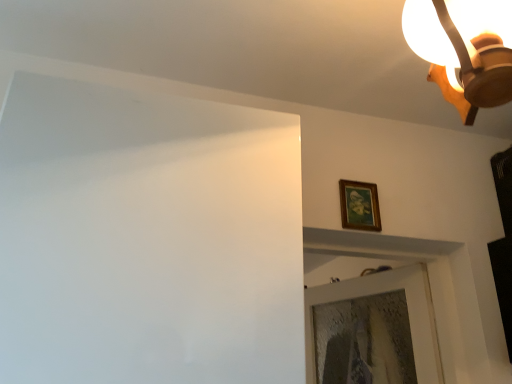
Question: From a real-world perspective, is wooden ceiling light at upper right located higher than wooden framed painting at upper right?

Choices:
 (A) yes
 (B) no

Answer: (A)

Question: Does wooden ceiling light at upper right lie in front of wooden framed painting at upper right?

Choices:
 (A) yes
 (B) no

Answer: (A)

Question: From a real-world perspective, is wooden ceiling light at upper right positioned under wooden framed painting at upper right based on gravity?

Choices:
 (A) yes
 (B) no

Answer: (B)

Question: From the image's perspective, is wooden ceiling light at upper right beneath wooden framed painting at upper right?

Choices:
 (A) no
 (B) yes

Answer: (A)

Question: Is wooden ceiling light at upper right next to wooden framed painting at upper right?

Choices:
 (A) yes
 (B) no

Answer: (B)

Question: Can you confirm if wooden ceiling light at upper right is taller than wooden framed painting at upper right?

Choices:
 (A) no
 (B) yes

Answer: (B)

Question: Is wooden framed painting at upper right to the right of wooden ceiling light at upper right from the viewer's perspective?

Choices:
 (A) no
 (B) yes

Answer: (A)

Question: Can you confirm if wooden framed painting at upper right is shorter than wooden ceiling light at upper right?

Choices:
 (A) yes
 (B) no

Answer: (A)

Question: Is the surface of wooden framed painting at upper right in direct contact with wooden ceiling light at upper right?

Choices:
 (A) yes
 (B) no

Answer: (B)

Question: Does wooden framed painting at upper right have a greater width compared to wooden ceiling light at upper right?

Choices:
 (A) no
 (B) yes

Answer: (A)

Question: Is wooden framed painting at upper right to the left of wooden ceiling light at upper right from the viewer's perspective?

Choices:
 (A) yes
 (B) no

Answer: (A)

Question: Can you confirm if wooden framed painting at upper right is smaller than wooden ceiling light at upper right?

Choices:
 (A) yes
 (B) no

Answer: (A)

Question: From the image's perspective, is wooden framed painting at upper right positioned above or below wooden ceiling light at upper right?

Choices:
 (A) above
 (B) below

Answer: (B)